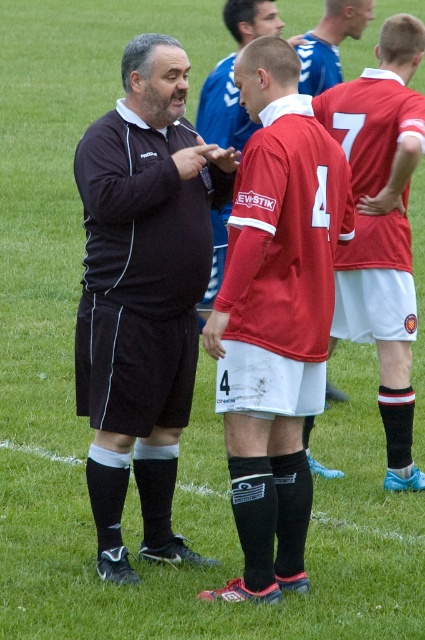
You are a soccer player trying to pass the ball to your teammate. You see the matte black shorts at center and the blue jersey at center. Which one is closer to you?

The matte black shorts at center is in front of the blue jersey at center, so it is closer to you.

You are a photographer positioned at the edge of the soccer field. You want to capture a photo where both the matte black shorts at center and the red matte jersey at center are clearly visible. Given their sizes, which object should you ensure is closer to the camera to avoid being too small in the photo?

The matte black shorts at center occupies less space than the red matte jersey at center, so you should ensure the matte black shorts at center is closer to the camera to avoid it appearing too small in the photo.